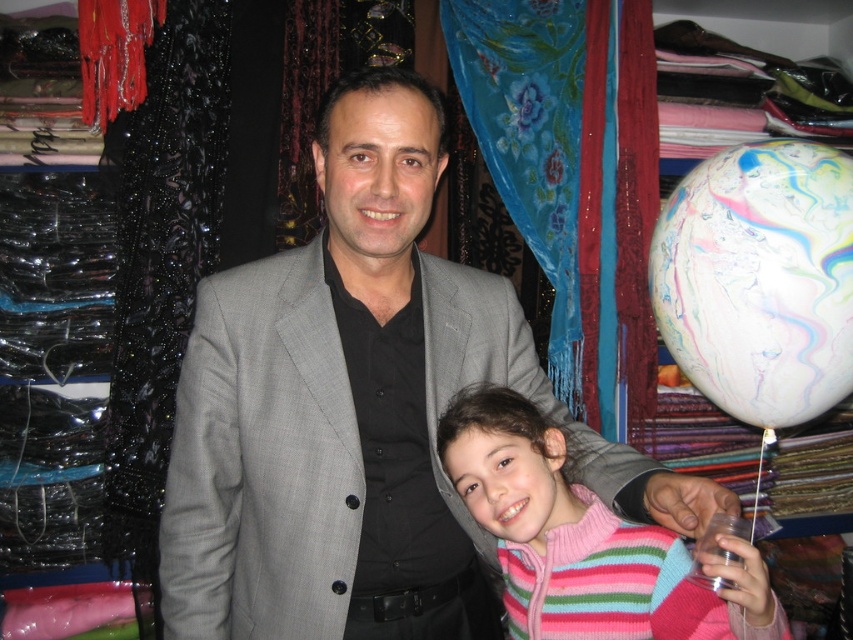
Can you confirm if pink striped sweater at center is smaller than transparent plastic cup at lower right?

Actually, pink striped sweater at center might be larger than transparent plastic cup at lower right.

The image size is (853, 640). What are the coordinates of `pink striped sweater at center` in the screenshot? It's located at (582, 540).

Is gray woolen suit at center bigger than transparent plastic cup at lower right?

Yes.

Between point (274, 445) and point (722, 552), which one is positioned behind?

The point (274, 445) is more distant.

Does point (631, 496) lie behind point (740, 531)?

That is True.

Locate an element on the screen. This screenshot has height=640, width=853. gray woolen suit at center is located at coordinates (358, 412).

Is gray woolen suit at center to the left of pink striped sweater at center from the viewer's perspective?

Correct, you'll find gray woolen suit at center to the left of pink striped sweater at center.

What do you see at coordinates (358, 412) in the screenshot? I see `gray woolen suit at center` at bounding box center [358, 412].

You are a GUI agent. You are given a task and a screenshot of the screen. Output one action in this format:
    pyautogui.click(x=<x>, y=<y>)
    Task: Click on the gray woolen suit at center
    The image size is (853, 640).
    Given the screenshot: What is the action you would take?
    pyautogui.click(x=358, y=412)

Locate an element on the screen. gray woolen suit at center is located at coordinates (358, 412).